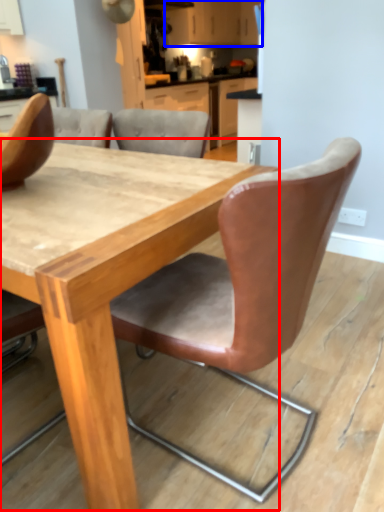
Question: Which object is closer to the camera taking this photo, table (highlighted by a red box) or cabinetry (highlighted by a blue box)?

Choices:
 (A) table
 (B) cabinetry

Answer: (A)